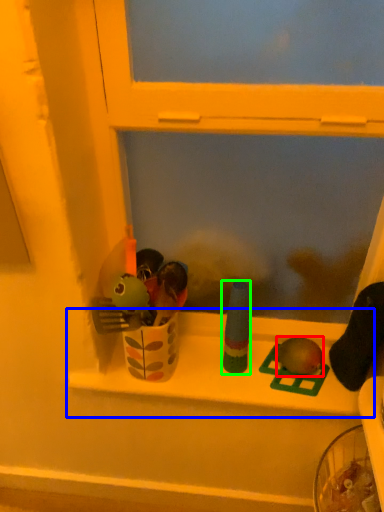
Question: Which is farther away from toy (highlighted by a red box)? window sill (highlighted by a blue box) or toy (highlighted by a green box)?

Choices:
 (A) window sill
 (B) toy

Answer: (A)